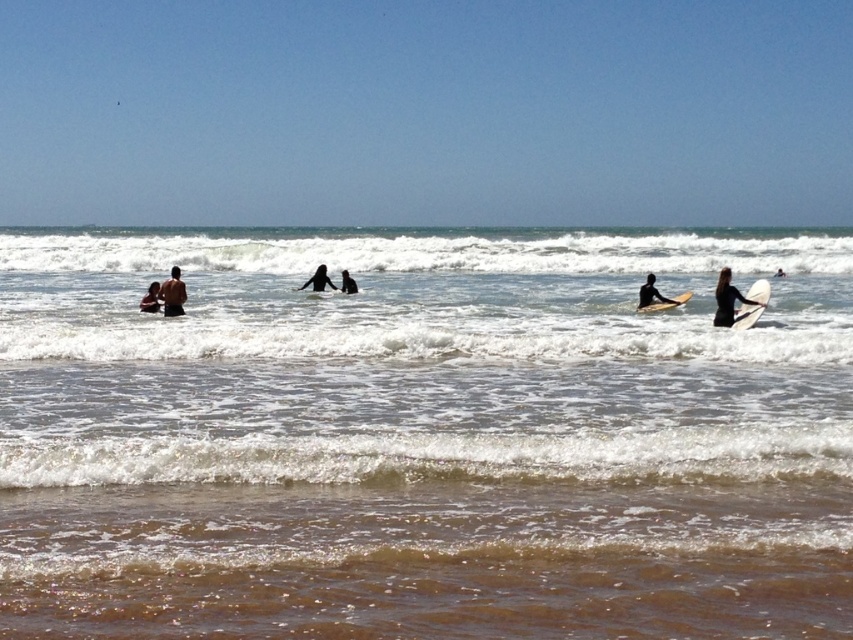
Between clear water at center and light brown smooth surfboard at right, which one appears on the right side from the viewer's perspective?

Positioned to the right is light brown smooth surfboard at right.

Which is below, clear water at center or light brown smooth surfboard at right?

Positioned lower is light brown smooth surfboard at right.

Does point (397, 396) come in front of point (656, 308)?

Yes.

This screenshot has height=640, width=853. Find the location of `clear water at center`. clear water at center is located at coordinates (422, 436).

Does clear water at center have a smaller size compared to black wetsuit at center?

Actually, clear water at center might be larger than black wetsuit at center.

Which is behind, point (552, 452) or point (347, 288)?

Positioned behind is point (347, 288).

Does point (819, 365) come behind point (347, 284)?

That is False.

Locate an element on the screen. The height and width of the screenshot is (640, 853). clear water at center is located at coordinates (422, 436).

Is clear water at center closer to camera compared to skinny man at center?

Yes, clear water at center is closer to the viewer.

Which is below, clear water at center or skinny man at center?

skinny man at center is lower down.

Between point (585, 282) and point (184, 285), which one is positioned behind?

Positioned behind is point (585, 282).

The image size is (853, 640). In order to click on clear water at center in this screenshot , I will do `click(422, 436)`.